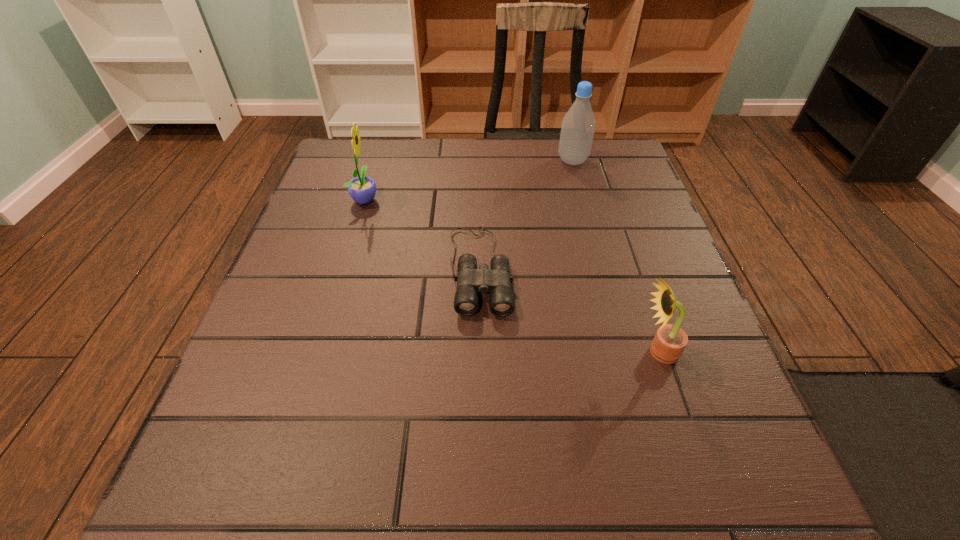
Where is `vacant space situated on the face of the shorter sunflower`? Image resolution: width=960 pixels, height=540 pixels. vacant space situated on the face of the shorter sunflower is located at coordinates (482, 352).

At what (x,y) coordinates should I click in order to perform the action: click on blank space located on the face of the shorter sunflower. Please return your answer as a coordinate pair (x, y). Image resolution: width=960 pixels, height=540 pixels. Looking at the image, I should click on (476, 352).

Where is `vacant space located at the eyepiece of the second object from left to right`? The height and width of the screenshot is (540, 960). vacant space located at the eyepiece of the second object from left to right is located at coordinates (480, 412).

This screenshot has height=540, width=960. What are the coordinates of `bottle that is positioned at the far edge` in the screenshot? It's located at (578, 126).

You are a GUI agent. You are given a task and a screenshot of the screen. Output one action in this format:
    pyautogui.click(x=<x>, y=<y>)
    Task: Click on the sunflower that is at the far edge
    This screenshot has width=960, height=540.
    Given the screenshot: What is the action you would take?
    pyautogui.click(x=362, y=189)

You are a GUI agent. You are given a task and a screenshot of the screen. Output one action in this format:
    pyautogui.click(x=<x>, y=<y>)
    Task: Click on the object located in the left edge section of the desktop
    The image size is (960, 540).
    Given the screenshot: What is the action you would take?
    pyautogui.click(x=362, y=189)

Image resolution: width=960 pixels, height=540 pixels. I want to click on bottle present at the right edge, so click(578, 126).

Find the location of a particular element. This screenshot has height=540, width=960. sunflower at the right edge is located at coordinates (669, 342).

You are a GUI agent. You are given a task and a screenshot of the screen. Output one action in this format:
    pyautogui.click(x=<x>, y=<y>)
    Task: Click on the object located at the far left corner
    The width and height of the screenshot is (960, 540).
    Given the screenshot: What is the action you would take?
    pyautogui.click(x=362, y=189)

Find the location of a particular element. object present at the far right corner is located at coordinates (578, 126).